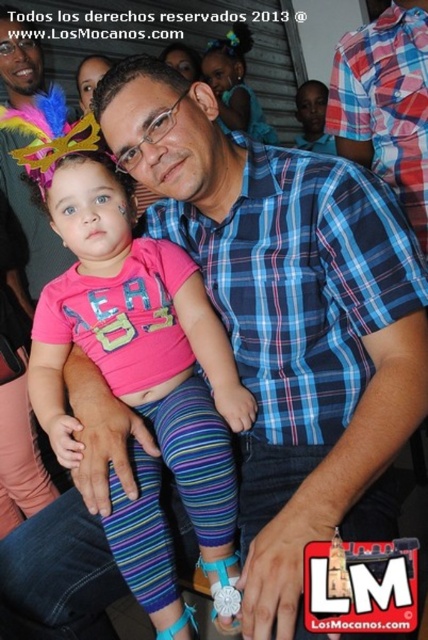
You are a photographer at a social event and notice the blue plaid shirt at center and the pink fabric dress at center in your frame. Which clothing item appears shorter in the image?

The blue plaid shirt at center appears shorter than the pink fabric dress at center in the image.

You are a photographer at an event and need to decide which pink fabric item to focus on for a closeup shot. The pink fabric shirt at center and the pink fabric dress at center are both in your frame. Which one should you choose if you want to capture more details of the clothing?

The pink fabric shirt at center has a smaller size compared to the pink fabric dress at center. Therefore, the pink fabric shirt at center would allow you to capture more details in the closeup shot since it requires less magnification to fill the frame.